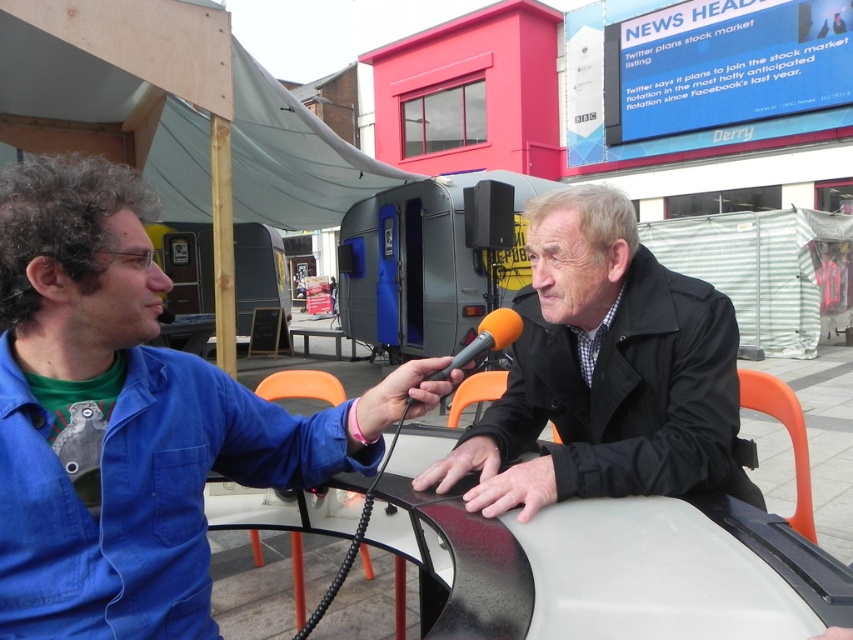
You are a photographer positioned at the camera. You need to capture a closeup shot of the blue cotton shirt at left. Given that your camera can focus on objects within 40 inches, will you be able to take the closeup?

The blue cotton shirt at left is 39.34 inches away from the camera, which is within the camera focus range of 40 inches. Therefore, you can take the closeup.